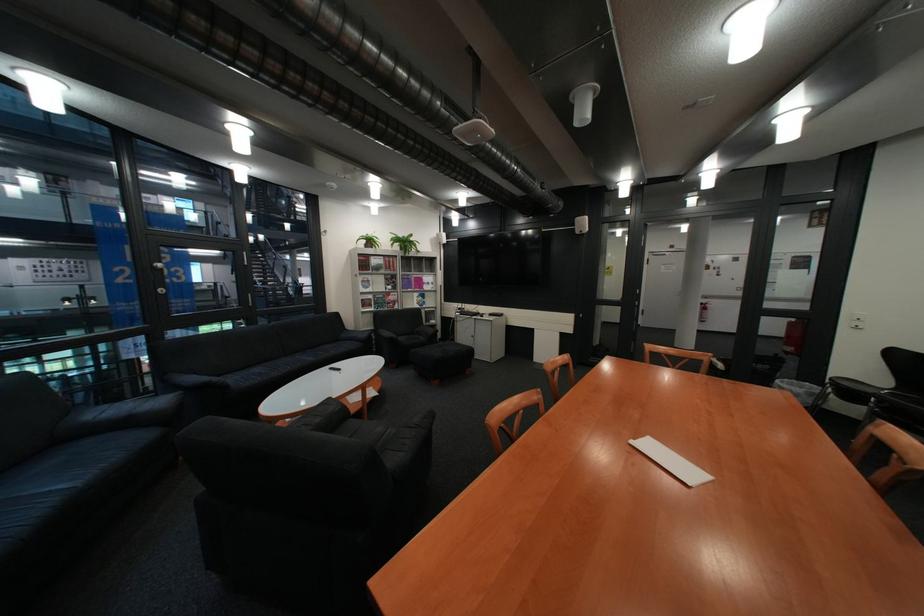
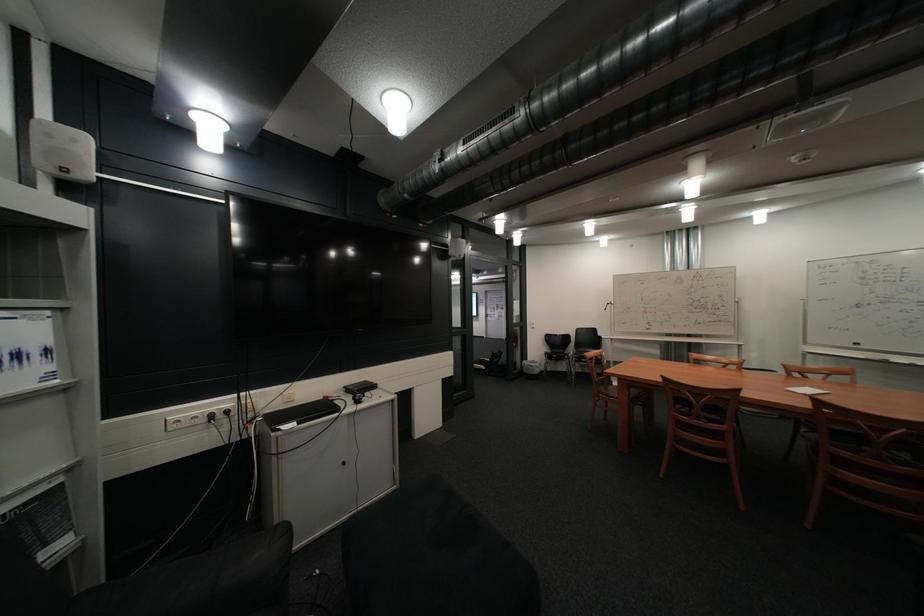
The point at (441, 310) is marked in the first image. Where is the corresponding point in the second image?

(10, 514)